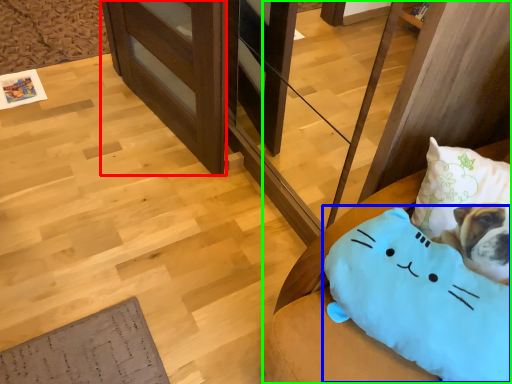
Question: Considering the real-world distances, which object is closest to shelf (highlighted by a red box)? pillow (highlighted by a blue box) or furniture (highlighted by a green box).

Choices:
 (A) pillow
 (B) furniture

Answer: (B)